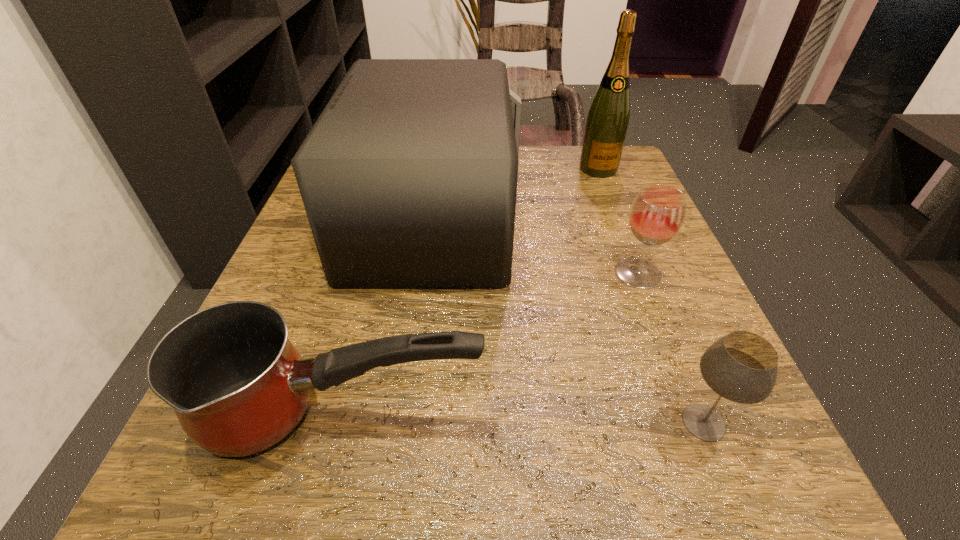
Where is `object present at the near right corner`? This screenshot has width=960, height=540. object present at the near right corner is located at coordinates (742, 367).

This screenshot has width=960, height=540. In the image, there is a desktop. Identify the location of vacant area at the far edge. (539, 173).

This screenshot has width=960, height=540. Find the location of `vacant space at the near edge`. vacant space at the near edge is located at coordinates (385, 509).

Where is `free space at the left edge of the desktop`? free space at the left edge of the desktop is located at coordinates (330, 301).

This screenshot has width=960, height=540. In order to click on free space at the right edge in this screenshot , I will do `click(623, 233)`.

Image resolution: width=960 pixels, height=540 pixels. In the image, there is a desktop. Find the location of `free region at the near left corner`. free region at the near left corner is located at coordinates (319, 440).

Where is `vacant area that lies between the saucepan and the microwave oven`? This screenshot has width=960, height=540. vacant area that lies between the saucepan and the microwave oven is located at coordinates (389, 316).

At what (x,y) coordinates should I click in order to perform the action: click on free spot between the saucepan and the nearer wineglass. Please return your answer as a coordinate pair (x, y). Looking at the image, I should click on (523, 419).

This screenshot has height=540, width=960. Find the location of `free space that is in between the wine bottle and the nearer wineglass`. free space that is in between the wine bottle and the nearer wineglass is located at coordinates (651, 295).

The width and height of the screenshot is (960, 540). I want to click on vacant space that is in between the nearer wineglass and the saucepan, so click(523, 419).